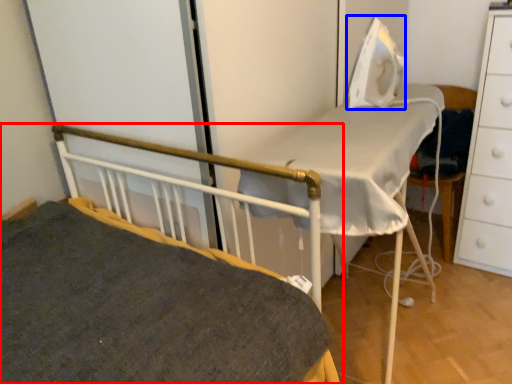
Question: Among these objects, which one is farthest to the camera, bed (highlighted by a red box) or equipment (highlighted by a blue box)?

Choices:
 (A) bed
 (B) equipment

Answer: (B)